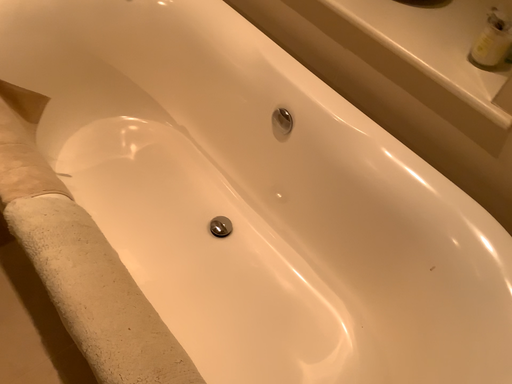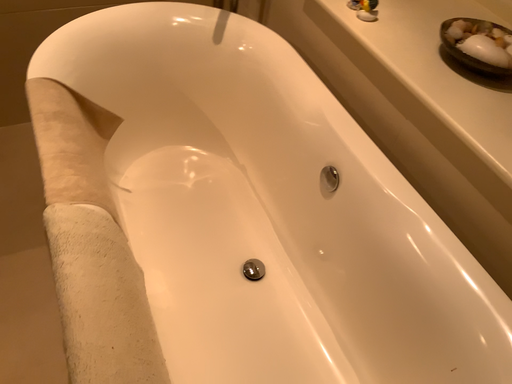
Question: Which way did the camera rotate in the video?

Choices:
 (A) rotated upward
 (B) rotated downward

Answer: (A)